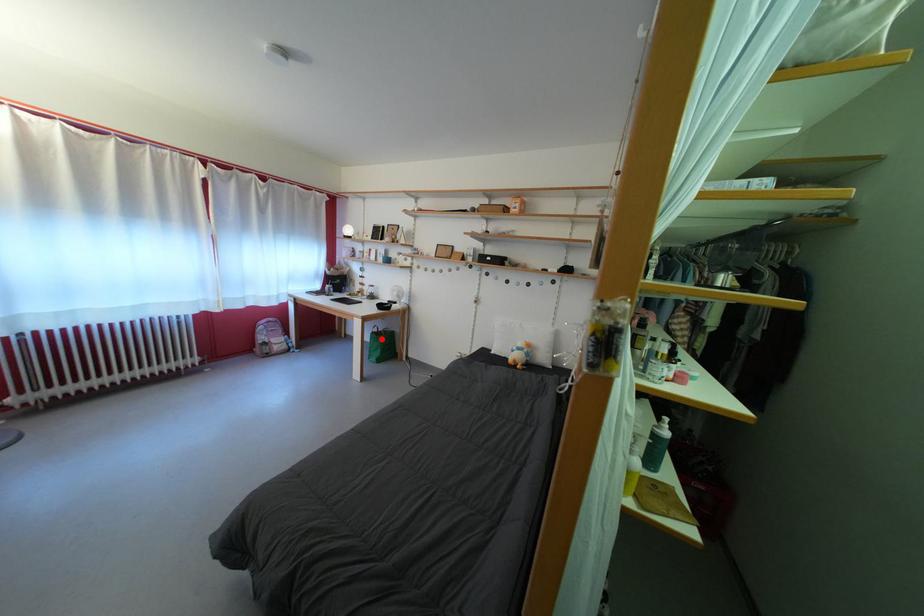
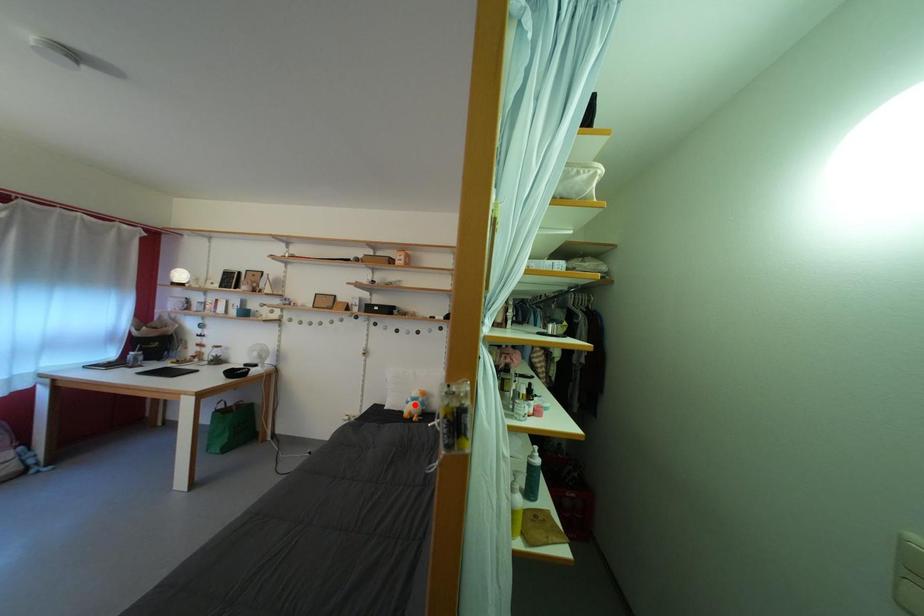
I am providing you with two images of the same scene from different viewpoints. A red point is marked on the first image and another point is marked on the second image. Does the point marked in image1 correspond to the same location as the one in image2?

No